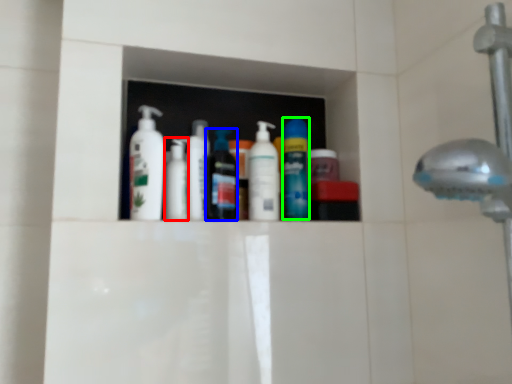
Question: Considering the real-world distances, which object is farthest from toiletry (highlighted by a red box)? mouthwash (highlighted by a blue box) or mouthwash (highlighted by a green box)?

Choices:
 (A) mouthwash
 (B) mouthwash

Answer: (B)